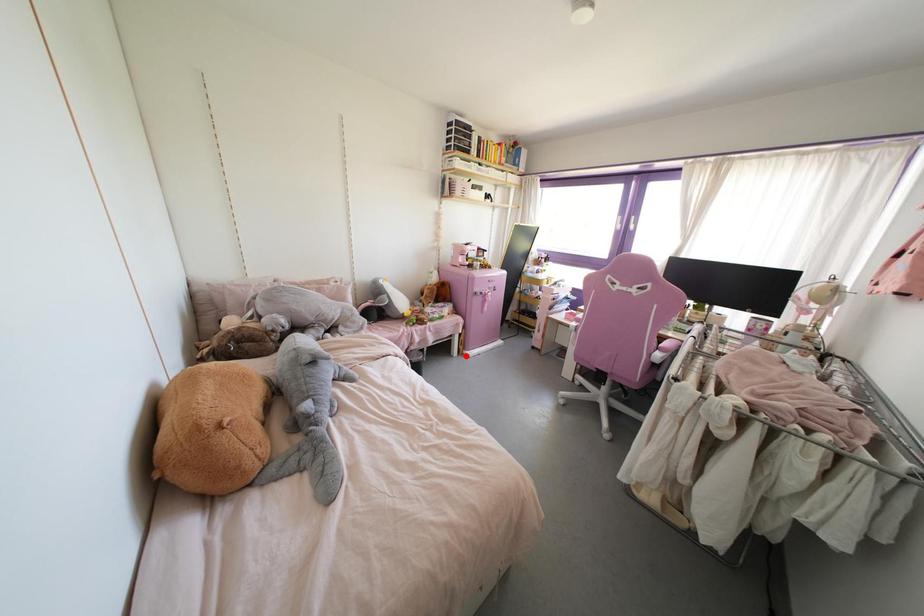
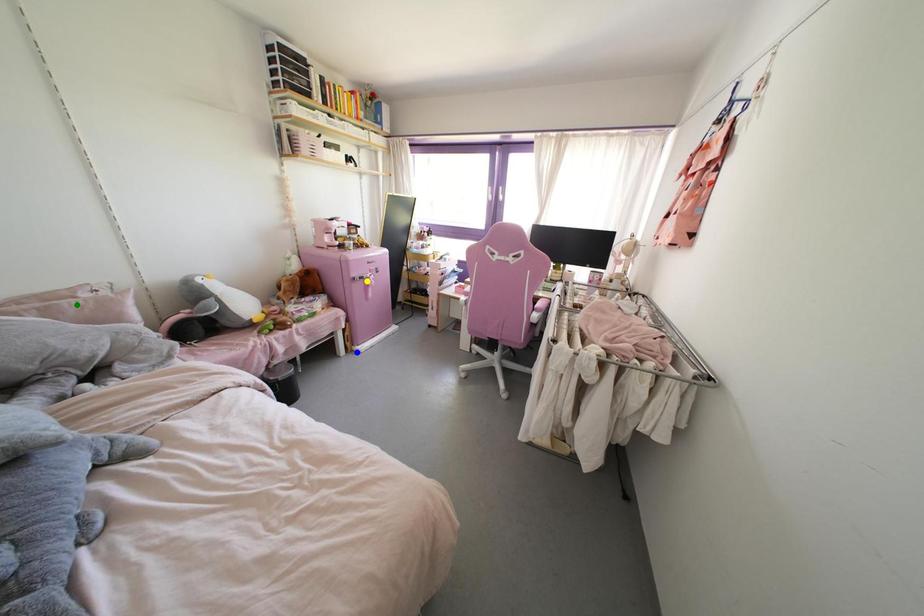
Question: I am providing you with two images of the same scene from different viewpoints. A red point is marked on the first image. You are given multiple points on the second image. Which point in image 2 is actually the same real-world point as the red point in image 1?

Choices:
 (A) yellow point
 (B) blue point
 (C) green point

Answer: (B)